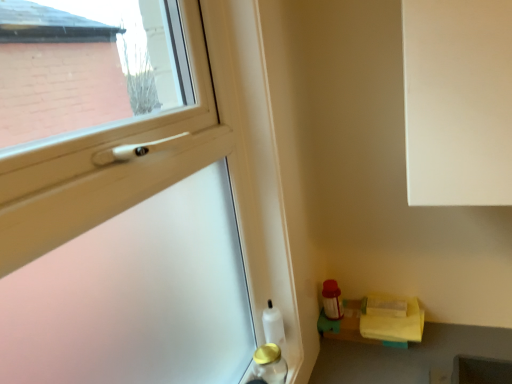
Locate an element on the screen. empty space that is ontop of yellow fabric at lower right (from a real-world perspective) is located at coordinates (368, 309).